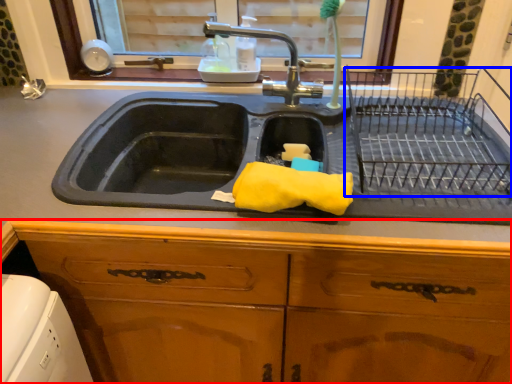
Question: Which of the following is the closest to the observer, cabinetry (highlighted by a red box) or cage (highlighted by a blue box)?

Choices:
 (A) cabinetry
 (B) cage

Answer: (B)